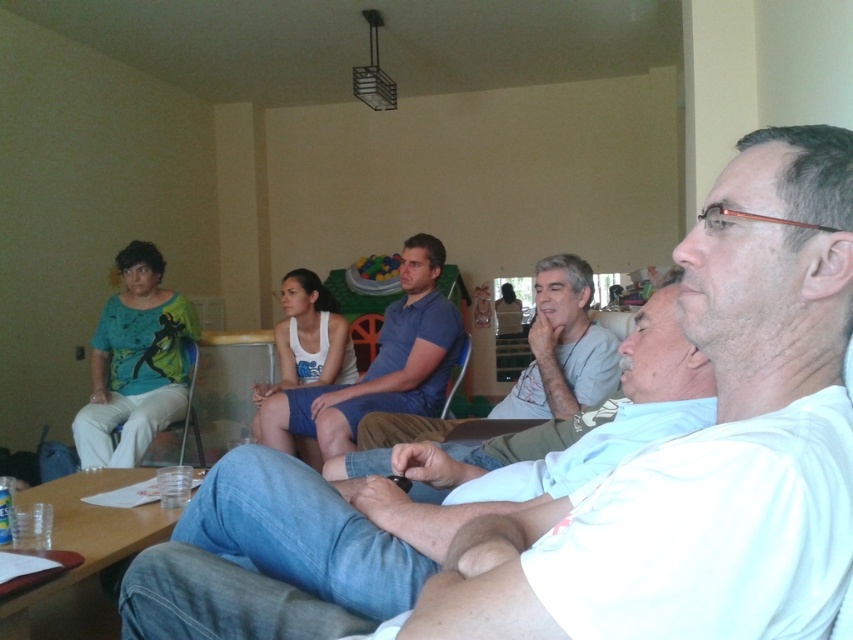
Is white cotton shirt at center taller than gray cotton shirt at center?

Incorrect, white cotton shirt at center's height is not larger of gray cotton shirt at center's.

At what (x,y) coordinates should I click in order to perform the action: click on white cotton shirt at center. Please return your answer as a coordinate pair (x, y). Looking at the image, I should click on (705, 445).

Between white cotton shirt at center and blue cotton shorts at center, which one appears on the left side from the viewer's perspective?

Positioned to the left is blue cotton shorts at center.

Does point (616, 500) come farther from viewer compared to point (283, 444)?

No.

This screenshot has width=853, height=640. I want to click on white cotton shirt at center, so click(x=705, y=445).

Is blue cotton shorts at center below gray cotton shirt at center?

No.

Does blue cotton shorts at center have a larger size compared to gray cotton shirt at center?

Yes.

Looking at this image, measure the distance between point (384, 369) and camera.

10.61 feet

At what (x,y) coordinates should I click in order to perform the action: click on blue cotton shorts at center. Please return your answer as a coordinate pair (x, y). The height and width of the screenshot is (640, 853). Looking at the image, I should click on (380, 364).